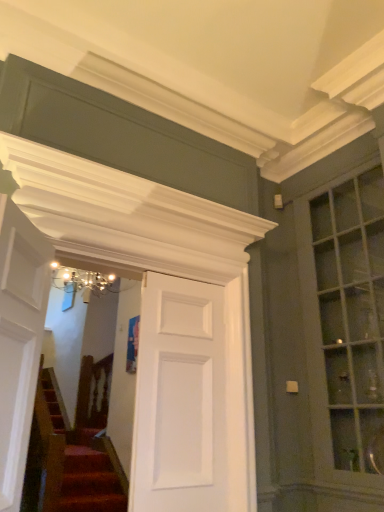
Identify the location of matte glass window at right. (345, 324).

What is the approximate height of white matte door at center, acting as the 2th door starting from the left?

It is 4.49 feet.

At what (x,y) coordinates should I click in order to perform the action: click on matte glass window at right. Please return your answer as a coordinate pair (x, y). The width and height of the screenshot is (384, 512). Looking at the image, I should click on (345, 324).

Image resolution: width=384 pixels, height=512 pixels. Identify the location of door that is the 2nd object directly below the matte glass window at right (from a real-world perspective). (179, 398).

In the scene shown: From the image's perspective, is white matte door at center, which is the 1th door from back to front, located above or below matte glass window at right?

white matte door at center, which is the 1th door from back to front, is below matte glass window at right.

Based on the photo, does white matte door at center, acting as the 2th door starting from the left, have a greater height compared to matte glass window at right?

Incorrect, the height of white matte door at center, acting as the 2th door starting from the left, is not larger of that of matte glass window at right.

From the picture: Considering the sizes of white matte door at center, positioned as the 1th door in right-to-left order, and white glossy door at left, positioned as the first door in left-to-right order, in the image, is white matte door at center, positioned as the 1th door in right-to-left order, wider or thinner than white glossy door at left, positioned as the first door in left-to-right order,?

white matte door at center, positioned as the 1th door in right-to-left order, is thinner than white glossy door at left, positioned as the first door in left-to-right order.

Is white glossy door at left, which ranks as the 1th door in front-to-back order, surrounded by white matte door at center, which is the 1th door from back to front?

Definitely not — white glossy door at left, which ranks as the 1th door in front-to-back order, is not inside white matte door at center, which is the 1th door from back to front.

From the image's perspective, is white matte door at center, which is the 1th door from back to front, over white glossy door at left, which ranks as the 1th door in front-to-back order?

Incorrect, from the image's perspective, white matte door at center, which is the 1th door from back to front, is lower than white glossy door at left, which ranks as the 1th door in front-to-back order.

Is white matte door at center, which is the 1th door from back to front, touching white glossy door at left, the second door viewed from the back?

white matte door at center, which is the 1th door from back to front, is not next to white glossy door at left, the second door viewed from the back, and they're not touching.

Is white glossy door at left, the 2th door from the right, surrounding matte glass window at right?

No, matte glass window at right is not a part of white glossy door at left, the 2th door from the right.

Where is `the 2nd door counting from the left side of the matte glass window at right`? The width and height of the screenshot is (384, 512). the 2nd door counting from the left side of the matte glass window at right is located at coordinates (19, 340).

Is white glossy door at left, the second door viewed from the back, thinner than matte glass window at right?

Correct, the width of white glossy door at left, the second door viewed from the back, is less than that of matte glass window at right.

Looking at this image, is white glossy door at left, positioned as the first door in left-to-right order, oriented towards white matte door at center, placed as the 2th door when sorted from front to back?

No, white glossy door at left, positioned as the first door in left-to-right order, is not facing towards white matte door at center, placed as the 2th door when sorted from front to back.

From the image's perspective, which one is positioned higher, white glossy door at left, positioned as the first door in left-to-right order, or white matte door at center, acting as the 2th door starting from the left?

white glossy door at left, positioned as the first door in left-to-right order.

Does white glossy door at left, the 2th door from the right, have a greater width compared to white matte door at center, placed as the 2th door when sorted from front to back?

Yes, white glossy door at left, the 2th door from the right, is wider than white matte door at center, placed as the 2th door when sorted from front to back.

This screenshot has height=512, width=384. I want to click on the 1st door in front when counting from the matte glass window at right, so click(179, 398).

Relative to white matte door at center, placed as the 2th door when sorted from front to back, is matte glass window at right in front or behind?

matte glass window at right is behind white matte door at center, placed as the 2th door when sorted from front to back.

Considering the sizes of objects matte glass window at right and white matte door at center, positioned as the 1th door in right-to-left order, in the image provided, who is wider, matte glass window at right or white matte door at center, positioned as the 1th door in right-to-left order,?

matte glass window at right.

Can you confirm if matte glass window at right is thinner than white glossy door at left, the second door viewed from the back?

No, matte glass window at right is not thinner than white glossy door at left, the second door viewed from the back.

Is matte glass window at right in front of or behind white glossy door at left, which ranks as the 1th door in front-to-back order, in the image?

matte glass window at right is positioned farther from the viewer than white glossy door at left, which ranks as the 1th door in front-to-back order.

Considering the sizes of objects matte glass window at right and white glossy door at left, the second door viewed from the back, in the image provided, who is smaller, matte glass window at right or white glossy door at left, the second door viewed from the back,?

With smaller size is white glossy door at left, the second door viewed from the back.

Does matte glass window at right touch white glossy door at left, the 2th door from the right?

No.

Starting from the matte glass window at right, which door is the 1st one to the left? Please provide its 2D coordinates.

[(179, 398)]

The width and height of the screenshot is (384, 512). In order to click on door behind the white glossy door at left, the second door viewed from the back in this screenshot , I will do pos(179,398).

Consider the image. From the image, which object appears to be nearer to white matte door at center, placed as the 2th door when sorted from front to back, white glossy door at left, positioned as the first door in left-to-right order, or matte glass window at right?

Among the two, white glossy door at left, positioned as the first door in left-to-right order, is located nearer to white matte door at center, placed as the 2th door when sorted from front to back.

Based on their spatial positions, is white glossy door at left, the 2th door from the right, or white matte door at center, which is the 1th door from back to front, closer to matte glass window at right?

white matte door at center, which is the 1th door from back to front, lies closer to matte glass window at right than the other object.

In the scene shown: Considering their positions, is white matte door at center, which is the 1th door from back to front, positioned further to matte glass window at right than white glossy door at left, the second door viewed from the back?

white glossy door at left, the second door viewed from the back.

Which object lies further to the anchor point white matte door at center, which is the 1th door from back to front, matte glass window at right or white glossy door at left, which ranks as the 1th door in front-to-back order?

The object further to white matte door at center, which is the 1th door from back to front, is matte glass window at right.

In the scene shown: From the image, which object appears to be nearer to white glossy door at left, the 2th door from the right, white matte door at center, positioned as the 1th door in right-to-left order, or matte glass window at right?

white matte door at center, positioned as the 1th door in right-to-left order, lies closer to white glossy door at left, the 2th door from the right, than the other object.

When comparing their distances from white glossy door at left, which ranks as the 1th door in front-to-back order, does matte glass window at right or white matte door at center, placed as the 2th door when sorted from front to back, seem closer?

white matte door at center, placed as the 2th door when sorted from front to back, is closer to white glossy door at left, which ranks as the 1th door in front-to-back order.

Identify the location of door situated between white glossy door at left, the 2th door from the right, and matte glass window at right from left to right. The image size is (384, 512). (179, 398).